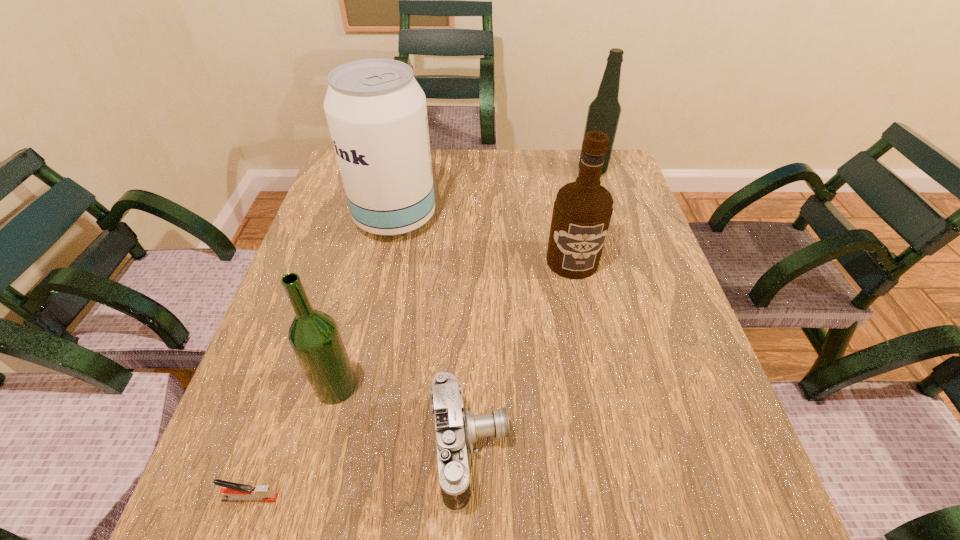
In the image, there is a desktop. Identify the location of vacant space at the right edge. This screenshot has height=540, width=960. (631, 241).

Where is `free location at the near right corner`? Image resolution: width=960 pixels, height=540 pixels. free location at the near right corner is located at coordinates click(673, 509).

Locate an element on the screen. Image resolution: width=960 pixels, height=540 pixels. free space between the rightmost alcohol and the shortest object is located at coordinates (421, 334).

This screenshot has height=540, width=960. Find the location of `free space between the farthest alcohol and the shortest object`. free space between the farthest alcohol and the shortest object is located at coordinates (421, 334).

This screenshot has width=960, height=540. I want to click on vacant area between the farthest alcohol and the stapler, so click(x=421, y=334).

Locate an element on the screen. The height and width of the screenshot is (540, 960). unoccupied position between the fifth tallest object and the farthest object is located at coordinates (531, 310).

What are the coordinates of `vacant region between the second object from right to left and the fourth object from left to right` in the screenshot? It's located at (521, 355).

Identify the location of free spot between the rightmost object and the camera. (531, 310).

Where is `free area in between the rightmost object and the fifth tallest object`? The image size is (960, 540). free area in between the rightmost object and the fifth tallest object is located at coordinates (531, 310).

Identify the location of empty space that is in between the nearest alcohol and the shortest object. Image resolution: width=960 pixels, height=540 pixels. (293, 442).